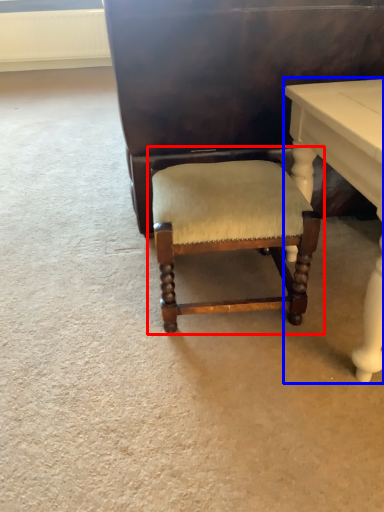
Question: Among these objects, which one is nearest to the camera, chair (highlighted by a red box) or table (highlighted by a blue box)?

Choices:
 (A) chair
 (B) table

Answer: (B)